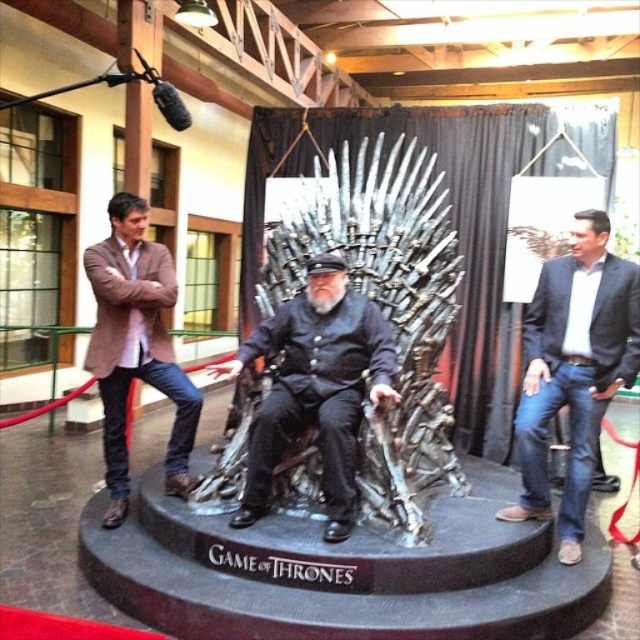
From the picture: You are a photographer at the event and need to capture a photo where both the ironmetallicthrone at center and the dark blue jeans at right are visible. Considering their height difference, which object will appear larger in the photo?

The ironmetallicthrone at center will appear larger in the photo because it is much taller than the dark blue jeans at right.